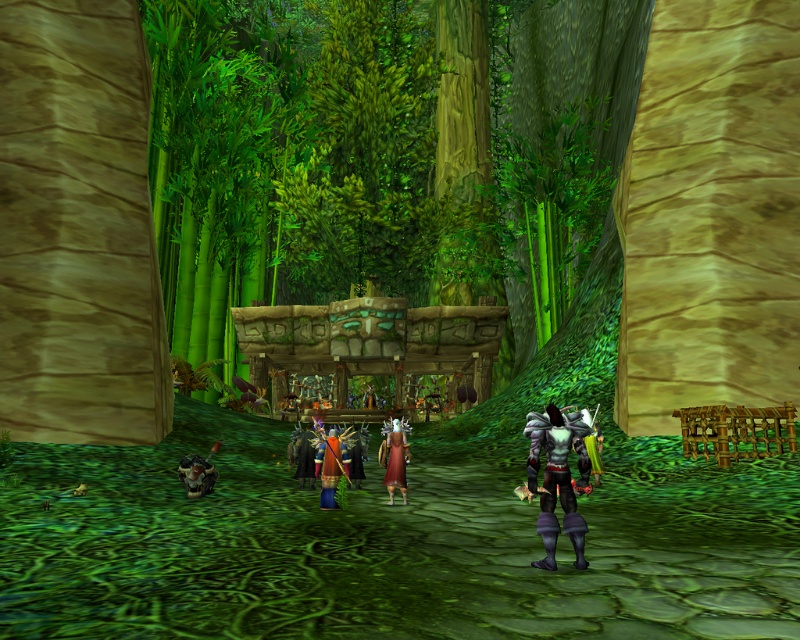
Question: Can you confirm if shiny black armor at center is smaller than maroon velvet dress at center?

Choices:
 (A) no
 (B) yes

Answer: (A)

Question: Considering the real-world distances, which object is closest to the shiny orange armor at center?

Choices:
 (A) shiny blue armor at center
 (B) maroon velvet dress at center
 (C) shiny black armor at center

Answer: (A)

Question: Which object is the farthest from the shiny orange armor at center?

Choices:
 (A) maroon velvet dress at center
 (B) shiny blue armor at center

Answer: (A)

Question: Observing the image, what is the correct spatial positioning of shiny black armor at center in reference to shiny orange armor at center?

Choices:
 (A) below
 (B) above

Answer: (B)

Question: Based on their relative distances, which object is farther from the maroon velvet dress at center?

Choices:
 (A) shiny black armor at center
 (B) shiny orange armor at center

Answer: (A)

Question: Does shiny black armor at center appear on the left side of maroon velvet dress at center?

Choices:
 (A) no
 (B) yes

Answer: (A)